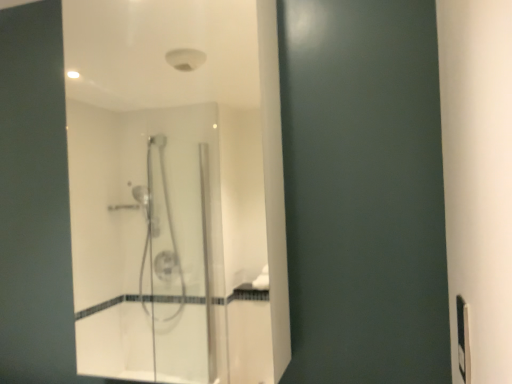
Question: Is black plastic electric outlet at right positioned with its back to transparent glass shower door at center?

Choices:
 (A) yes
 (B) no

Answer: (B)

Question: From a real-world perspective, is black plastic electric outlet at right located higher than transparent glass shower door at center?

Choices:
 (A) yes
 (B) no

Answer: (B)

Question: Are black plastic electric outlet at right and transparent glass shower door at center beside each other?

Choices:
 (A) no
 (B) yes

Answer: (A)

Question: Does black plastic electric outlet at right have a lesser height compared to transparent glass shower door at center?

Choices:
 (A) yes
 (B) no

Answer: (A)

Question: Is black plastic electric outlet at right bigger than transparent glass shower door at center?

Choices:
 (A) yes
 (B) no

Answer: (B)

Question: Considering the relative positions of black plastic electric outlet at right and transparent glass shower door at center in the image provided, is black plastic electric outlet at right in front of transparent glass shower door at center?

Choices:
 (A) no
 (B) yes

Answer: (B)

Question: Is transparent glass shower door at center wider than black plastic electric outlet at right?

Choices:
 (A) no
 (B) yes

Answer: (B)

Question: Are transparent glass shower door at center and black plastic electric outlet at right located far from each other?

Choices:
 (A) no
 (B) yes

Answer: (B)

Question: Does transparent glass shower door at center appear on the left side of black plastic electric outlet at right?

Choices:
 (A) yes
 (B) no

Answer: (A)

Question: Is transparent glass shower door at center outside black plastic electric outlet at right?

Choices:
 (A) yes
 (B) no

Answer: (A)

Question: Is transparent glass shower door at center bigger than black plastic electric outlet at right?

Choices:
 (A) yes
 (B) no

Answer: (A)

Question: From a real-world perspective, is transparent glass shower door at center on top of black plastic electric outlet at right?

Choices:
 (A) yes
 (B) no

Answer: (A)

Question: Is black plastic electric outlet at right in front of or behind transparent glass shower door at center in the image?

Choices:
 (A) front
 (B) behind

Answer: (A)